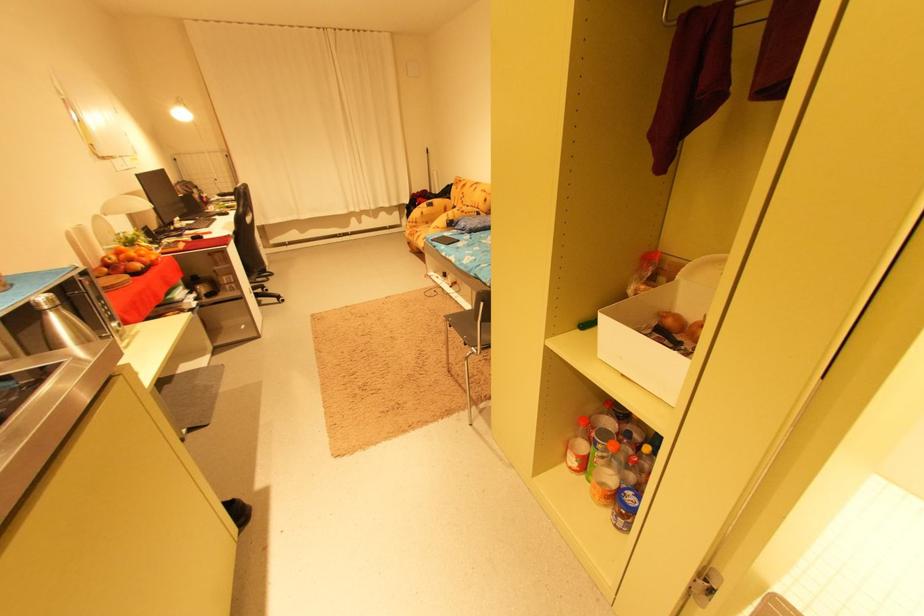
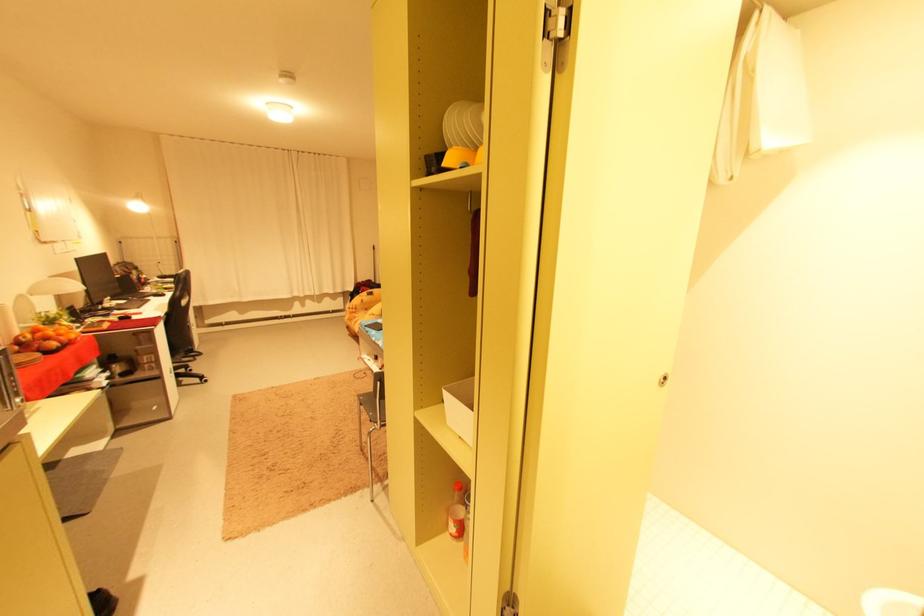
Where in the second image is the point corresponding to (x=151, y=265) from the first image?

(68, 344)